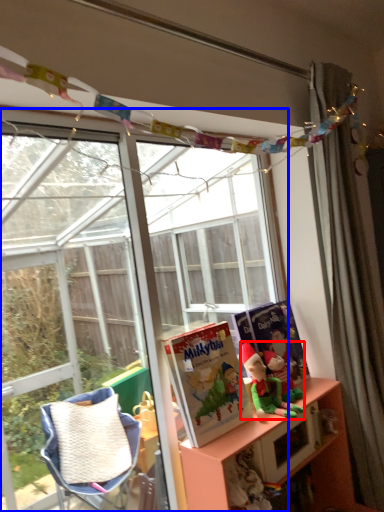
Question: Among these objects, which one is nearest to the camera, person (highlighted by a red box) or window (highlighted by a blue box)?

Choices:
 (A) person
 (B) window

Answer: (B)